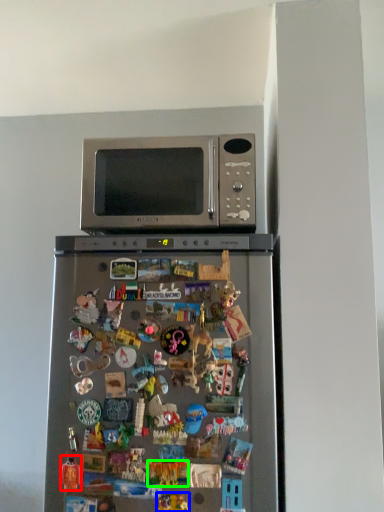
Question: Which object is positioned closest to toy (highlighted by a red box)? Select from toy (highlighted by a blue box) and toy (highlighted by a green box).

Choices:
 (A) toy
 (B) toy

Answer: (B)